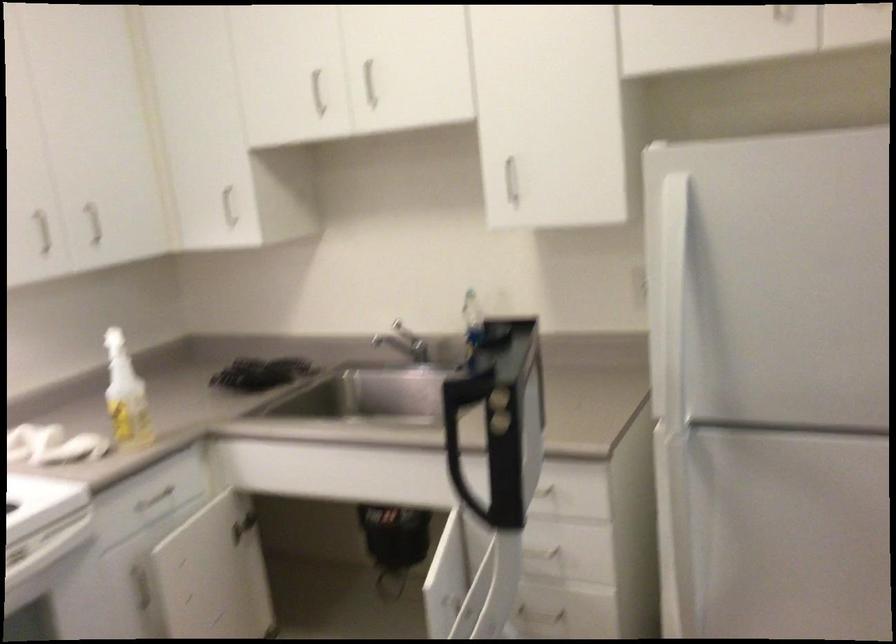
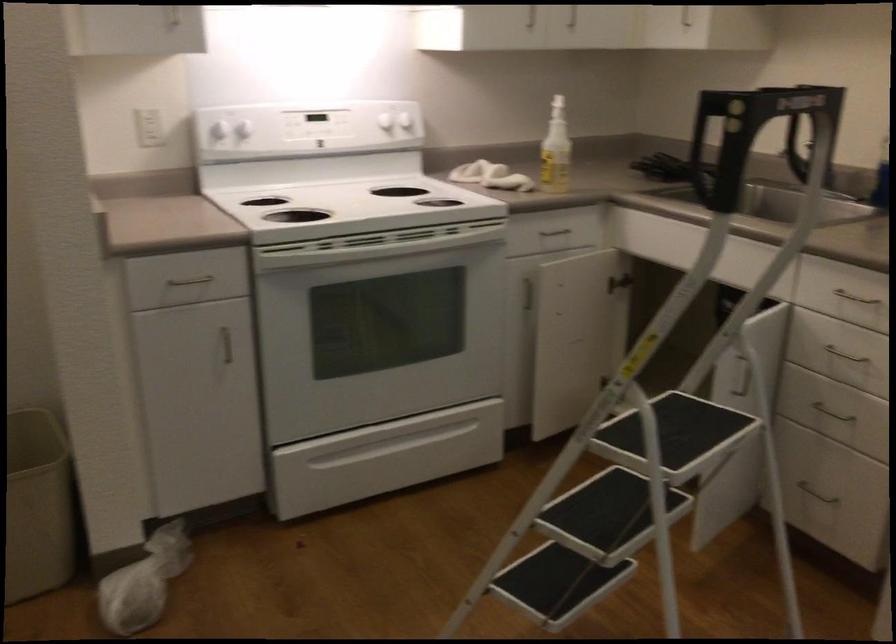
In the second image, find the point that corresponds to point (229, 220) in the first image.

(685, 19)